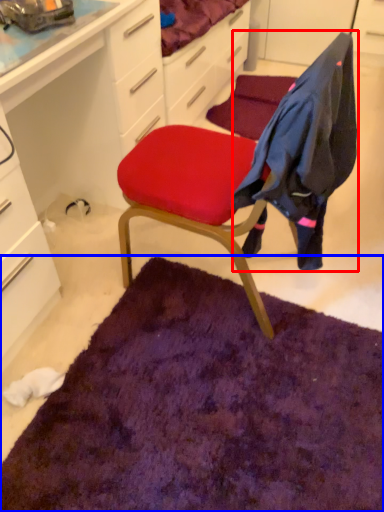
Question: Which object is closer to the camera taking this photo, clothing (highlighted by a red box) or mat (highlighted by a blue box)?

Choices:
 (A) clothing
 (B) mat

Answer: (A)